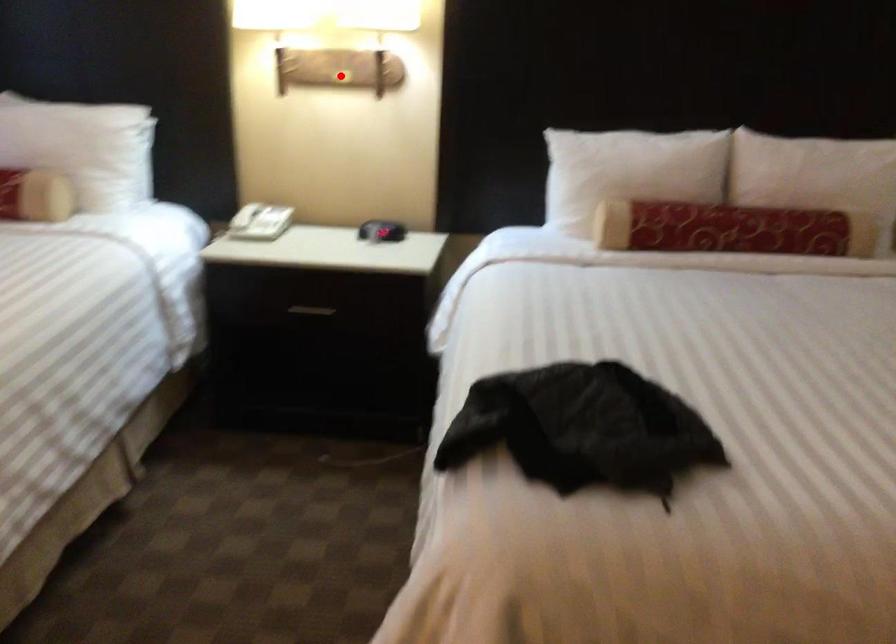
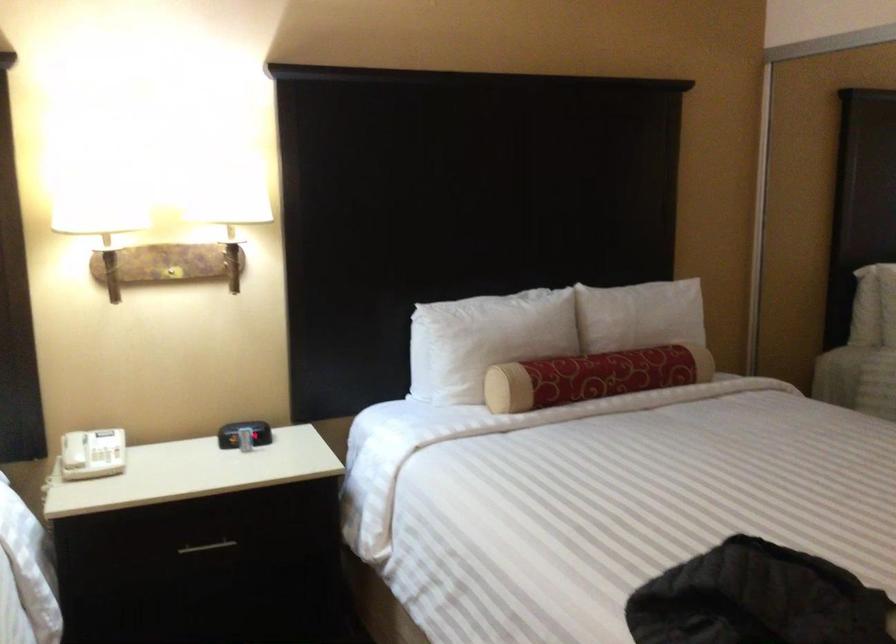
Where in the second image is the point corresponding to the highlighted location from the first image?

(171, 272)